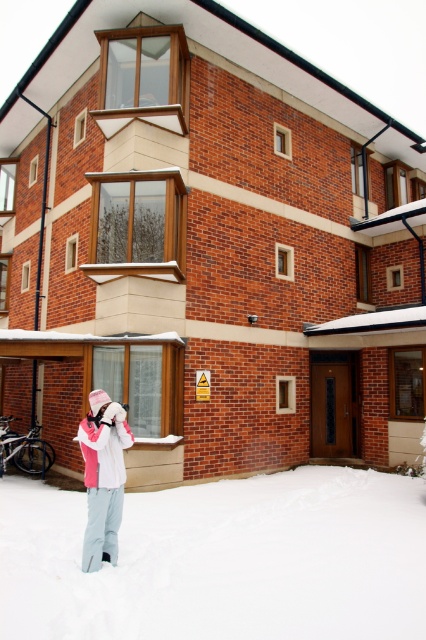
You are standing at the point marked as point (221,561) in the snowy outdoor scene. What is the terrain like at that location?

The terrain at point (221,561) is white fluffy snow at lower center.

You are an observer looking at the snowy scene. You notice the white fluffy snow at lower center and the white fleece jacket at lower left. Which object is taller?

The white fleece jacket at lower left is taller than the white fluffy snow at lower center.

You are a photographer trying to capture the scene with the white fluffy snow at lower center and the white fleece jacket at lower left. Which object is closer to you, the photographer?

The white fluffy snow at lower center is closer to you than the white fleece jacket at lower left because it is further to the viewer according to the description.